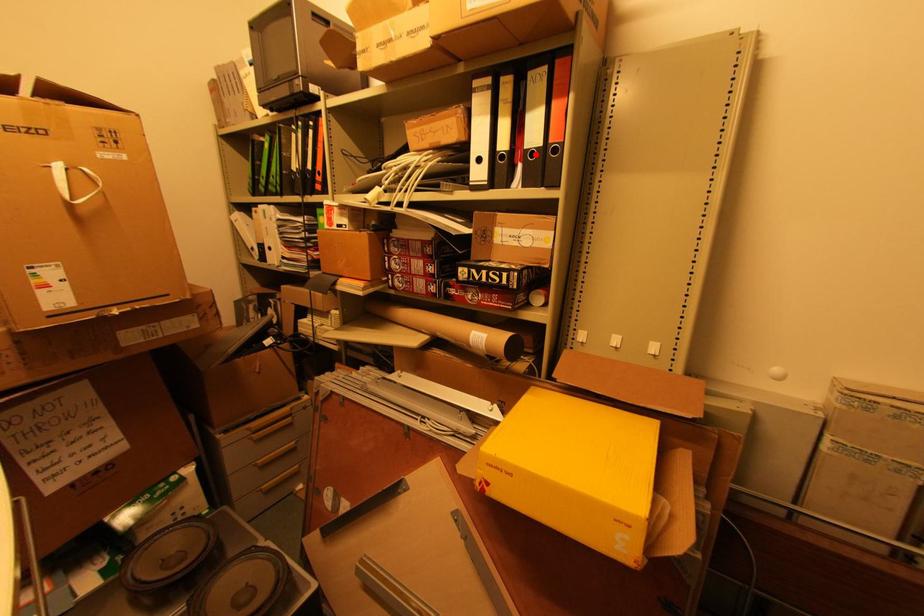
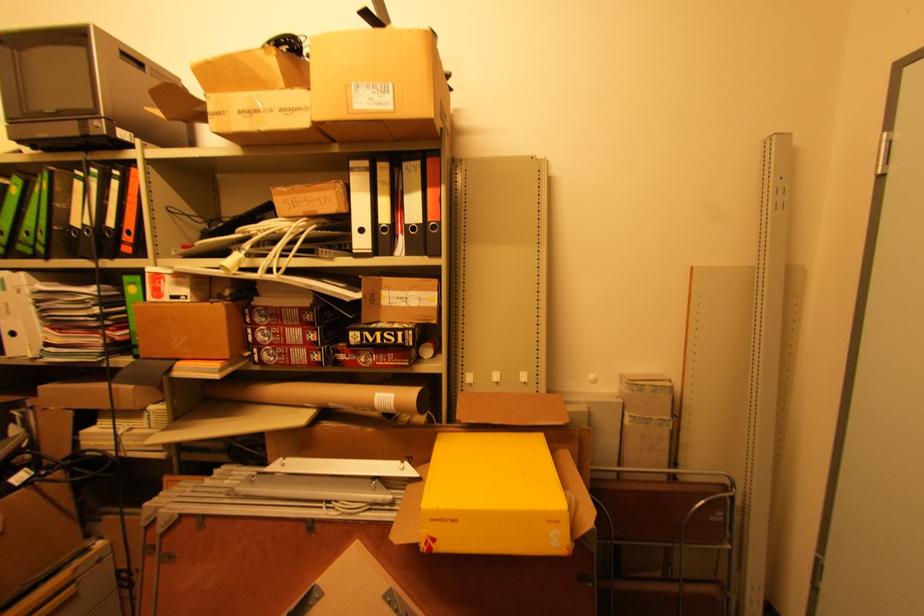
Find the pixel in the second image that matches the highlighted location in the first image.

(417, 229)